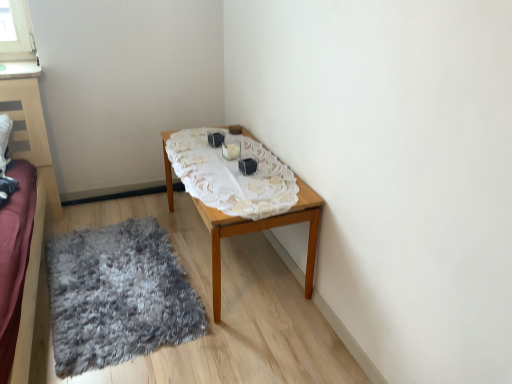
Locate an element on the screen. This screenshot has width=512, height=384. free space between wooden table at center and gray shaggy rug at lower left is located at coordinates (152, 217).